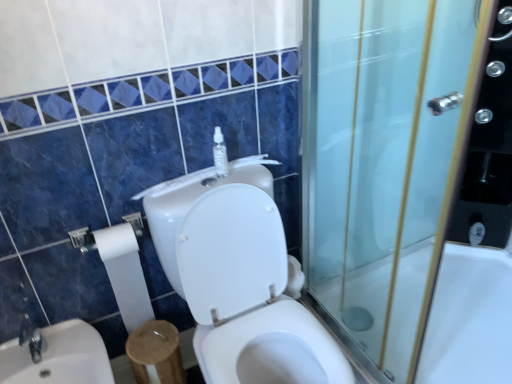
This screenshot has width=512, height=384. What do you see at coordinates (59, 357) in the screenshot?
I see `white glossy sink at lower left` at bounding box center [59, 357].

This screenshot has width=512, height=384. Describe the element at coordinates (125, 273) in the screenshot. I see `white paper at left` at that location.

The width and height of the screenshot is (512, 384). Identify the location of transparent glass screen door at right. (385, 160).

This screenshot has width=512, height=384. Describe the element at coordinates (239, 278) in the screenshot. I see `white glossy toilet at center` at that location.

The image size is (512, 384). I want to click on white glossy sink at lower left, so click(59, 357).

Is white paper at left at the back of transparent glass screen door at right?

No, white paper at left is not at the back of transparent glass screen door at right.

How many degrees apart are the facing directions of transparent glass screen door at right and white paper at left?

transparent glass screen door at right and white paper at left are facing 91.1 degrees away from each other.

Choose the correct answer: Is transparent glass screen door at right inside white paper at left or outside it?

The correct answer is: outside.

Would you say transparent glass screen door at right is to the left or to the right of white paper at left in the picture?

Clearly, transparent glass screen door at right is on the right of white paper at left in the image.

Is white paper at left not within white glossy sink at lower left?

Yes.

In the image, is white paper at left positioned in front of or behind white glossy sink at lower left?

white paper at left is behind white glossy sink at lower left.

Looking at the image, does white paper at left seem bigger or smaller compared to white glossy sink at lower left?

Considering their sizes, white paper at left takes up less space than white glossy sink at lower left.

Where is `toilet paper above the white glossy sink at lower left (from the image's perspective)`? toilet paper above the white glossy sink at lower left (from the image's perspective) is located at coordinates tap(125, 273).

Considering the positions of objects transparent glass screen door at right and white glossy toilet at center in the image provided, who is in front, transparent glass screen door at right or white glossy toilet at center?

transparent glass screen door at right is in front.

Is transparent glass screen door at right at the right side of white glossy toilet at center?

Yes, transparent glass screen door at right is to the right of white glossy toilet at center.

The width and height of the screenshot is (512, 384). In order to click on screen door above the white glossy toilet at center (from the image's perspective) in this screenshot , I will do `click(385, 160)`.

Considering the points (343, 314) and (296, 304), which point is in front, point (343, 314) or point (296, 304)?

Positioned in front is point (296, 304).

From the image's perspective, which one is positioned lower, clear plastic bottle at upper center or transparent glass screen door at right?

From the image's view, transparent glass screen door at right is below.

Is clear plastic bottle at upper center wider than transparent glass screen door at right?

In fact, clear plastic bottle at upper center might be narrower than transparent glass screen door at right.

Is clear plastic bottle at upper center inside the boundaries of transparent glass screen door at right, or outside?

clear plastic bottle at upper center is not inside transparent glass screen door at right, it's outside.

Which is more to the right, clear plastic bottle at upper center or transparent glass screen door at right?

transparent glass screen door at right.

Is white glossy sink at lower left shorter than transparent glass screen door at right?

Indeed, white glossy sink at lower left has a lesser height compared to transparent glass screen door at right.

Locate an element on the screen. Image resolution: width=512 pixels, height=384 pixels. screen door located above the white glossy sink at lower left (from the image's perspective) is located at coordinates (385, 160).

Looking at this image, from the image's perspective, who appears lower, white glossy sink at lower left or transparent glass screen door at right?

From the image's view, white glossy sink at lower left is below.

From the picture: Is white glossy sink at lower left facing towards white glossy bathtub at right?

No, white glossy sink at lower left is not aimed at white glossy bathtub at right.

Does white glossy sink at lower left appear on the left side of white glossy bathtub at right?

Correct, you'll find white glossy sink at lower left to the left of white glossy bathtub at right.

Which is less distant, (92, 354) or (497, 346)?

Clearly, point (92, 354) is closer to the camera than point (497, 346).

Between clear plastic bottle at upper center and white paper at left, which one has smaller size?

clear plastic bottle at upper center is smaller.

Is there a large distance between clear plastic bottle at upper center and white paper at left?

No.

You are a GUI agent. You are given a task and a screenshot of the screen. Output one action in this format:
    pyautogui.click(x=<x>, y=<y>)
    Task: Click on the soap dispenser lying on the right of white paper at left
    The width and height of the screenshot is (512, 384).
    Given the screenshot: What is the action you would take?
    pyautogui.click(x=220, y=154)

Is clear plastic bottle at upper center at the right side of white paper at left?

Indeed, clear plastic bottle at upper center is positioned on the right side of white paper at left.

I want to click on toilet paper behind the transparent glass screen door at right, so click(x=125, y=273).

The width and height of the screenshot is (512, 384). I want to click on toilet paper above the white glossy sink at lower left (from the image's perspective), so click(125, 273).

Estimate the real-world distances between objects in this image. Which object is closer to white glossy bathtub at right, white glossy sink at lower left or white paper at left?

white paper at left is positioned closer to the anchor white glossy bathtub at right.

Considering their positions, is transparent glass screen door at right positioned closer to white glossy sink at lower left than clear plastic bottle at upper center?

clear plastic bottle at upper center is closer to white glossy sink at lower left.

Based on their spatial positions, is clear plastic bottle at upper center or white glossy sink at lower left further from white glossy bathtub at right?

→ Among the two, white glossy sink at lower left is located further to white glossy bathtub at right.

Which object lies nearer to the anchor point clear plastic bottle at upper center, white glossy sink at lower left or white paper at left?

The object closer to clear plastic bottle at upper center is white paper at left.

Looking at the image, which one is located further to white glossy bathtub at right, clear plastic bottle at upper center or transparent glass screen door at right?

Based on the image, clear plastic bottle at upper center appears to be further to white glossy bathtub at right.

Which object lies further to the anchor point white glossy bathtub at right, white glossy sink at lower left or transparent glass screen door at right?

Among the two, white glossy sink at lower left is located further to white glossy bathtub at right.

Estimate the real-world distances between objects in this image. Which object is further from white glossy bathtub at right, transparent glass screen door at right or clear plastic bottle at upper center?

clear plastic bottle at upper center lies further to white glossy bathtub at right than the other object.

In the scene shown: From the image, which object appears to be farther from white glossy sink at lower left, clear plastic bottle at upper center or white glossy bathtub at right?

white glossy bathtub at right is positioned further to the anchor white glossy sink at lower left.

Identify the location of soap dispenser between white glossy sink at lower left and transparent glass screen door at right. This screenshot has height=384, width=512. (220, 154).

The width and height of the screenshot is (512, 384). In order to click on toilet between clear plastic bottle at upper center and white glossy sink at lower left in the vertical direction in this screenshot , I will do `click(239, 278)`.

Where is `toilet between white paper at left and transparent glass screen door at right in the horizontal direction`? toilet between white paper at left and transparent glass screen door at right in the horizontal direction is located at coordinates (239, 278).

This screenshot has height=384, width=512. What are the coordinates of `toilet paper situated between white glossy sink at lower left and white glossy toilet at center from left to right` in the screenshot? It's located at (125, 273).